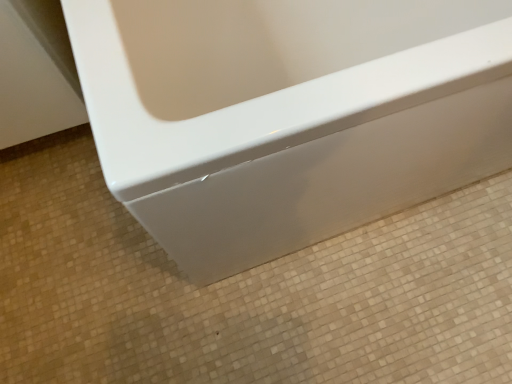
Question: Is white glossy bathtub at center thinner than glossy white bathtub at center?

Choices:
 (A) no
 (B) yes

Answer: (A)

Question: Does white glossy bathtub at center appear on the left side of glossy white bathtub at center?

Choices:
 (A) yes
 (B) no

Answer: (A)

Question: Is white glossy bathtub at center surrounding glossy white bathtub at center?

Choices:
 (A) yes
 (B) no

Answer: (B)

Question: Is glossy white bathtub at center at the back of white glossy bathtub at center?

Choices:
 (A) yes
 (B) no

Answer: (B)

Question: Can you confirm if white glossy bathtub at center is taller than glossy white bathtub at center?

Choices:
 (A) yes
 (B) no

Answer: (B)

Question: From a real-world perspective, is white glossy bathtub at center on top of glossy white bathtub at center?

Choices:
 (A) no
 (B) yes

Answer: (A)

Question: Is glossy white bathtub at center facing towards white glossy bathtub at center?

Choices:
 (A) no
 (B) yes

Answer: (A)

Question: Is glossy white bathtub at center at the right side of white glossy bathtub at center?

Choices:
 (A) yes
 (B) no

Answer: (A)

Question: Would you consider glossy white bathtub at center to be distant from white glossy bathtub at center?

Choices:
 (A) no
 (B) yes

Answer: (A)

Question: Is glossy white bathtub at center taller than white glossy bathtub at center?

Choices:
 (A) yes
 (B) no

Answer: (A)

Question: From the image's perspective, does glossy white bathtub at center appear higher than white glossy bathtub at center?

Choices:
 (A) yes
 (B) no

Answer: (A)

Question: From a real-world perspective, is glossy white bathtub at center physically above white glossy bathtub at center?

Choices:
 (A) no
 (B) yes

Answer: (B)

Question: Is point (65, 291) closer or farther from the camera than point (221, 137)?

Choices:
 (A) farther
 (B) closer

Answer: (A)